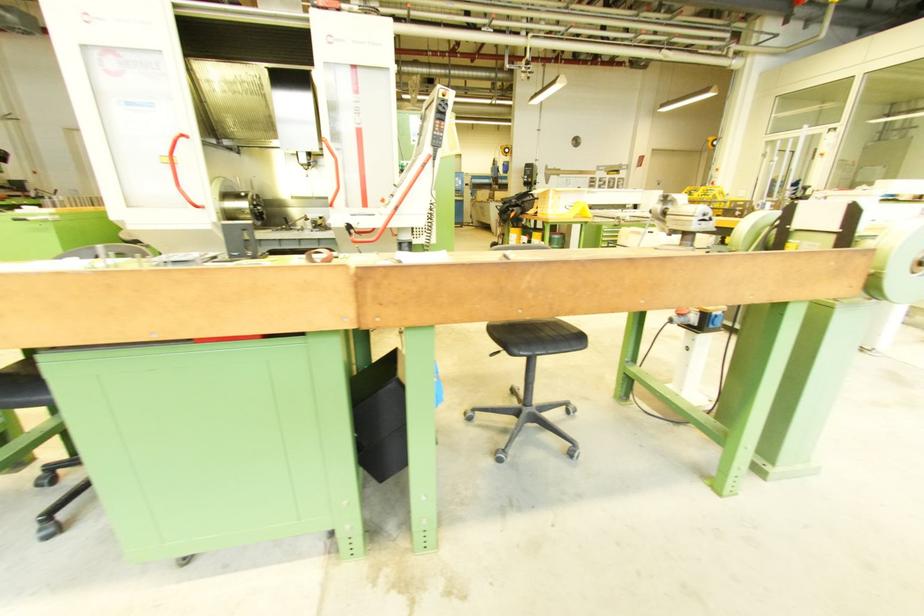
I want to click on black chair sitting surface, so click(x=536, y=337).